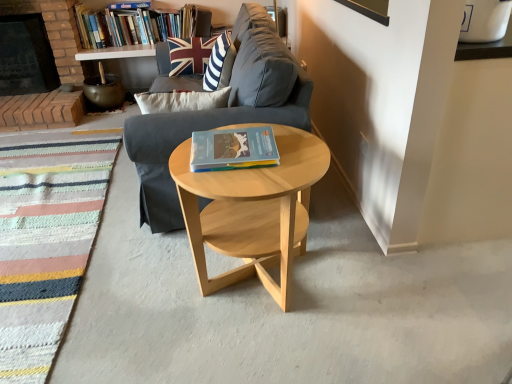
Identify the location of vacant space to the right of natural wood side table at center. (360, 281).